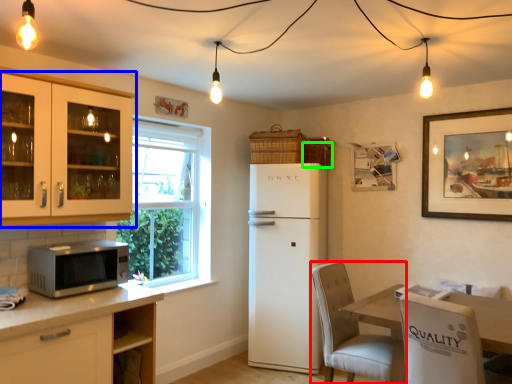
Question: Which object is the farthest from chair (highlighted by a red box)? Choose among these: cabinetry (highlighted by a blue box) or basket (highlighted by a green box).

Choices:
 (A) cabinetry
 (B) basket

Answer: (A)